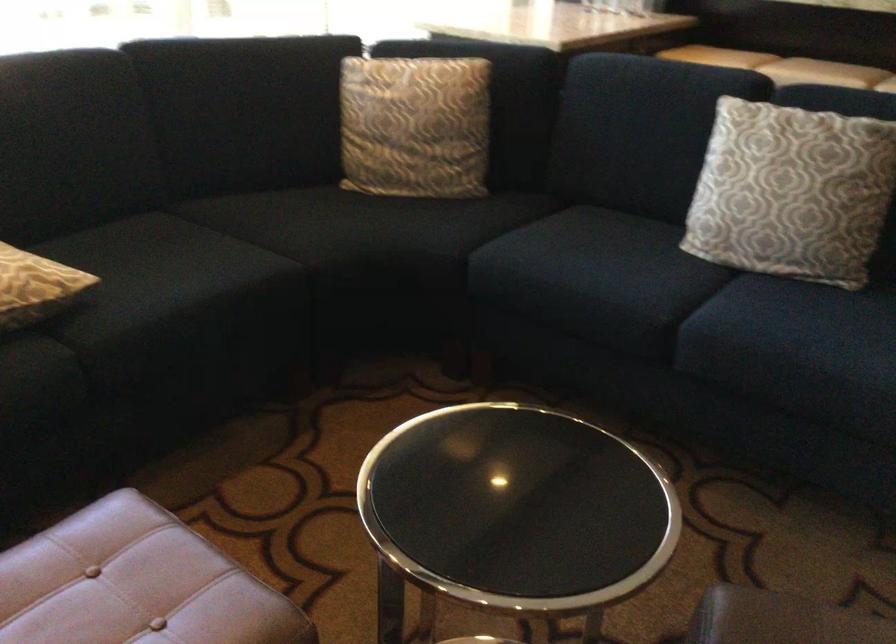
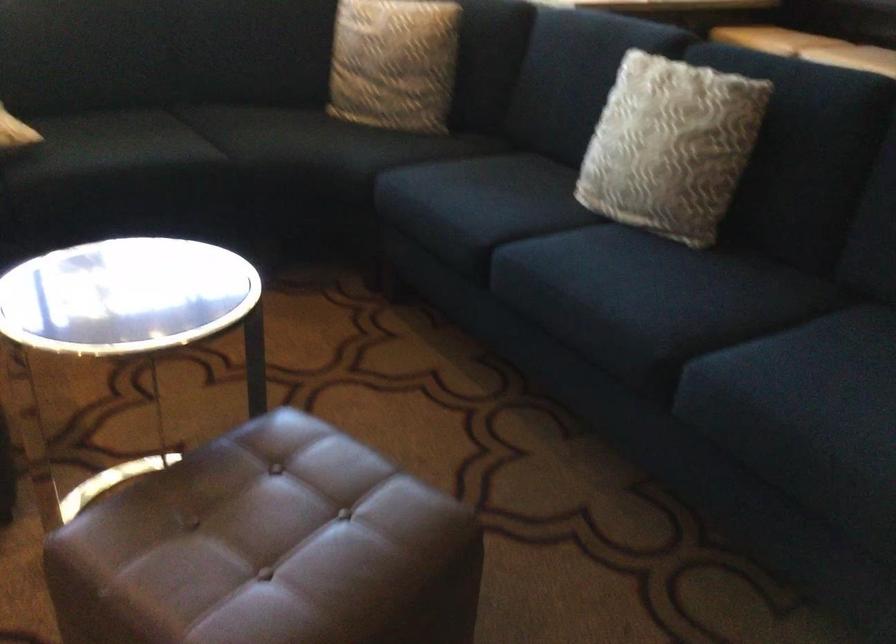
Question: The images are taken continuously from a first-person perspective. In which direction is your viewpoint rotating?

Choices:
 (A) Left
 (B) Right
 (C) Up
 (D) Down

Answer: (A)